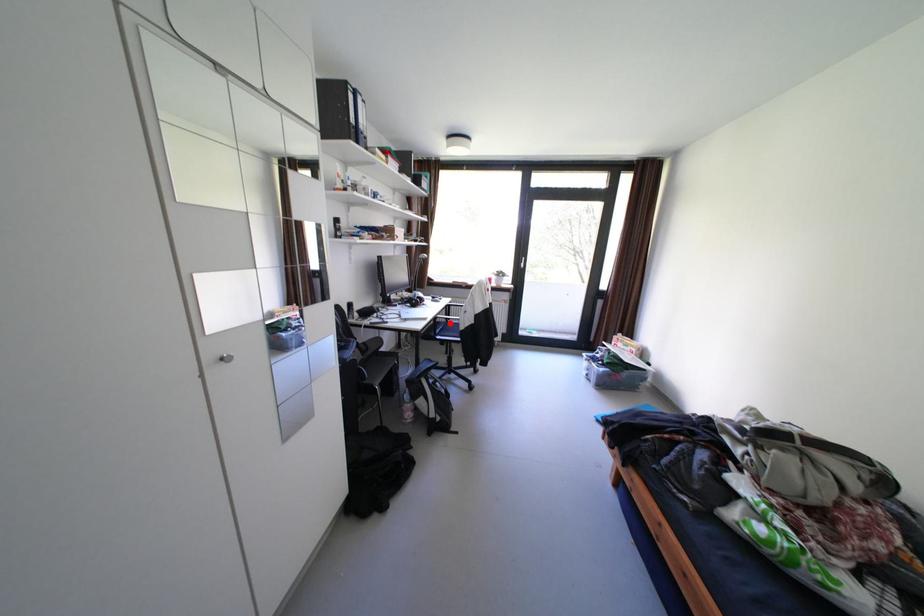
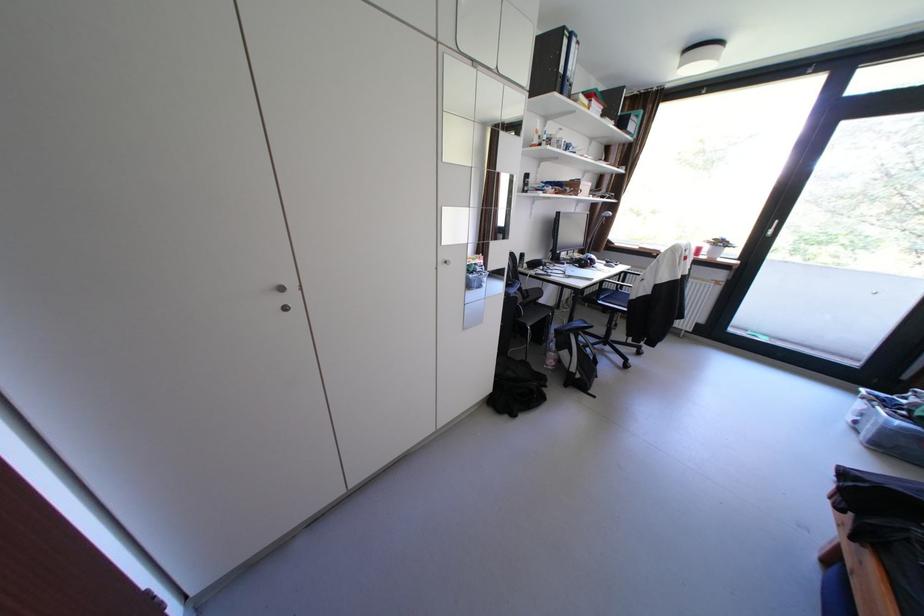
Question: I am providing you with two images of the same scene from different viewpoints. A red point is shown in image1. For the corresponding object point in image2, is it positioned nearer or farther from the camera?

Choices:
 (A) Nearer
 (B) Farther

Answer: (A)